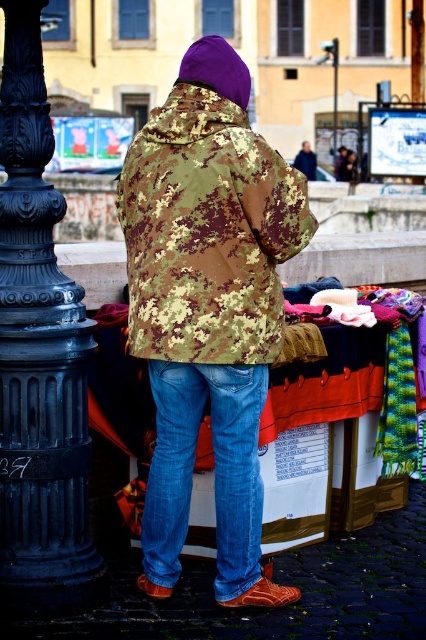
You are a delivery person trying to navigate through the street. You need to pass between the black cast iron post at left and the metallic pole at upper center. Which direction should you move to avoid hitting either object?

You should move to the right side, as the black cast iron post at left is closer to you than the metallic pole at upper center, so moving right would keep you away from both objects.

You are a city planner assessing the street layout. You need to determine which of the two objects, the black cast iron post at left or the metallic pole at upper center, requires more space for maintenance access. Based on their sizes, which one would need a larger area?

The metallic pole at upper center requires a larger maintenance area because it is bigger than the black cast iron post at left.